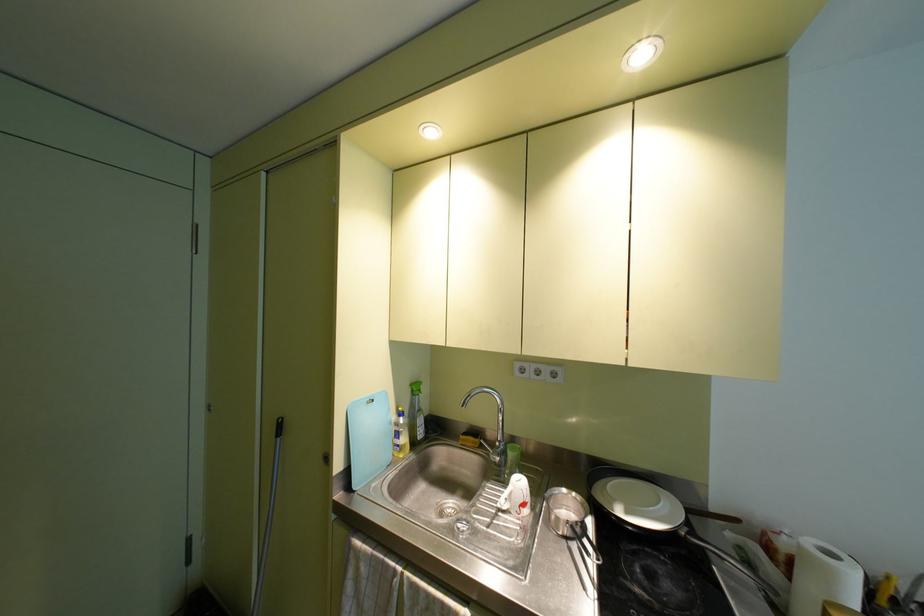
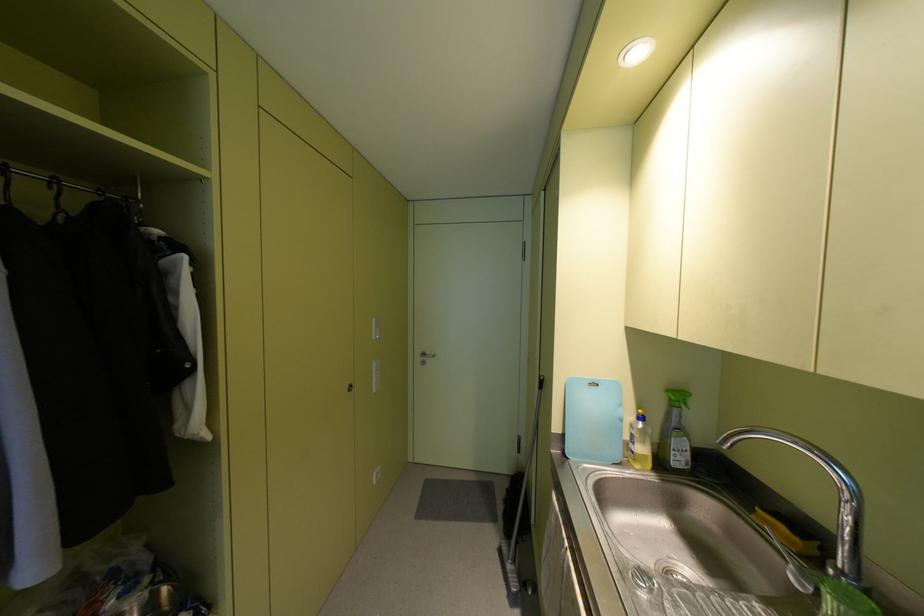
The point at (459,436) is marked in the first image. Where is the corresponding point in the second image?

(759, 511)